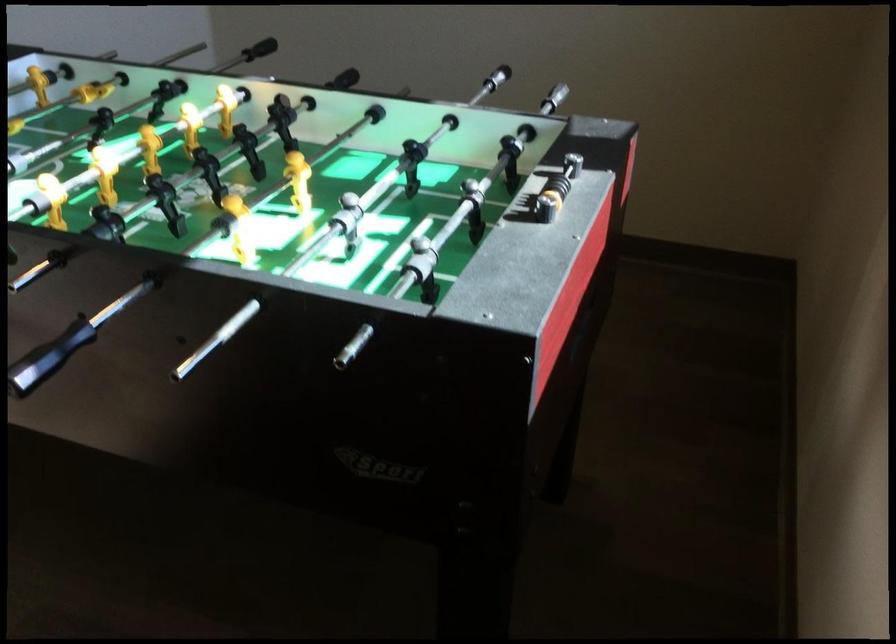
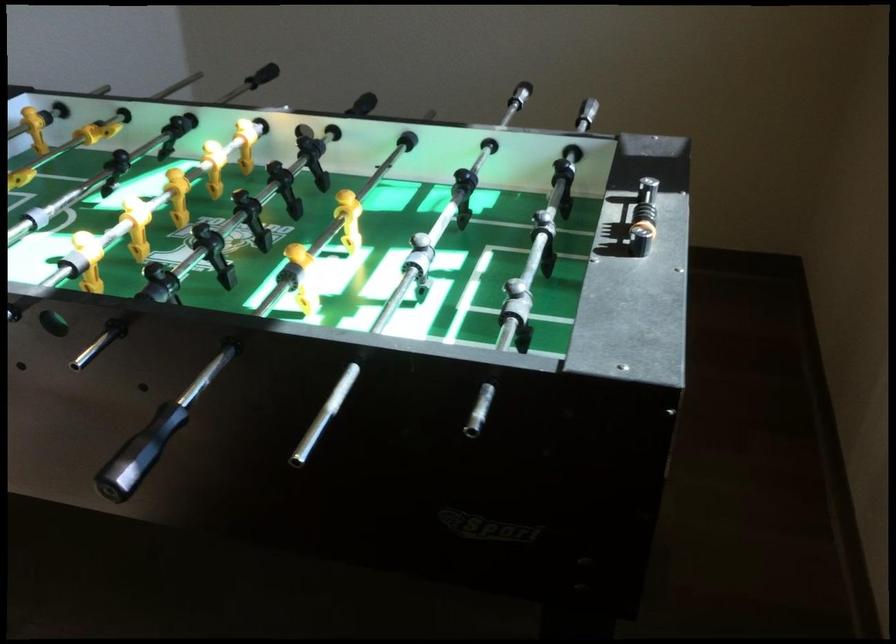
Question: The camera is either moving clockwise (left) or counter-clockwise (right) around the object. The first image is from the beginning of the video and the second image is from the end. Is the camera moving left or right when shooting the video?

Choices:
 (A) Left
 (B) Right

Answer: (A)